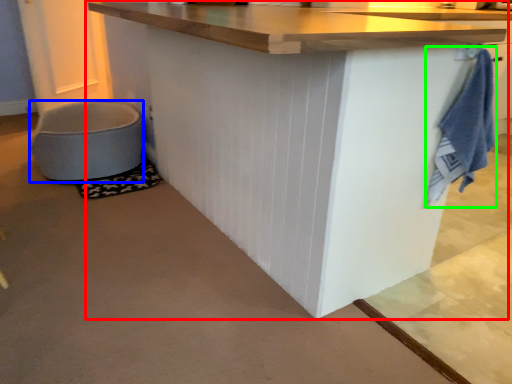
Question: Based on their relative distances, which object is nearer to table (highlighted by a red box)? Choose from toilet bowl (highlighted by a blue box) and bath towel (highlighted by a green box).

Choices:
 (A) toilet bowl
 (B) bath towel

Answer: (B)